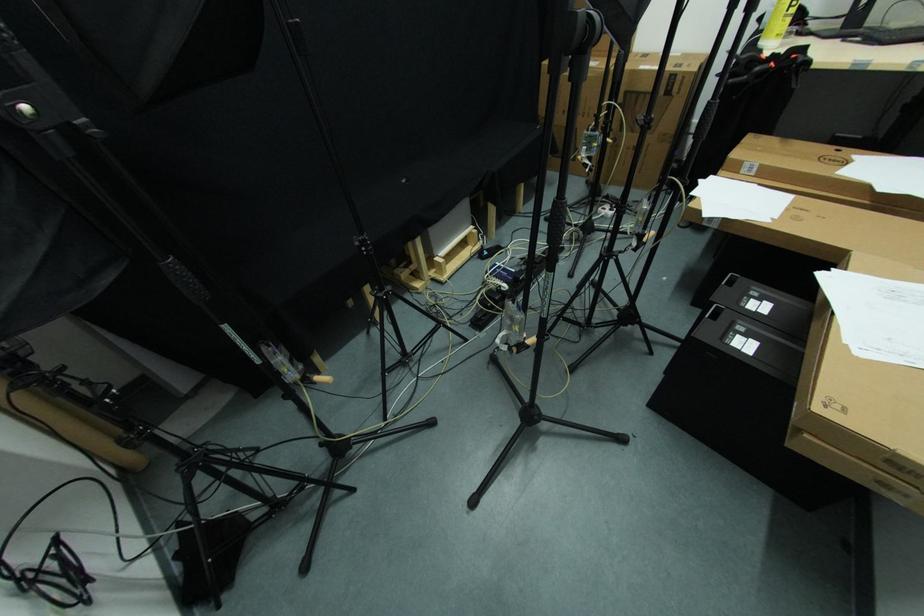
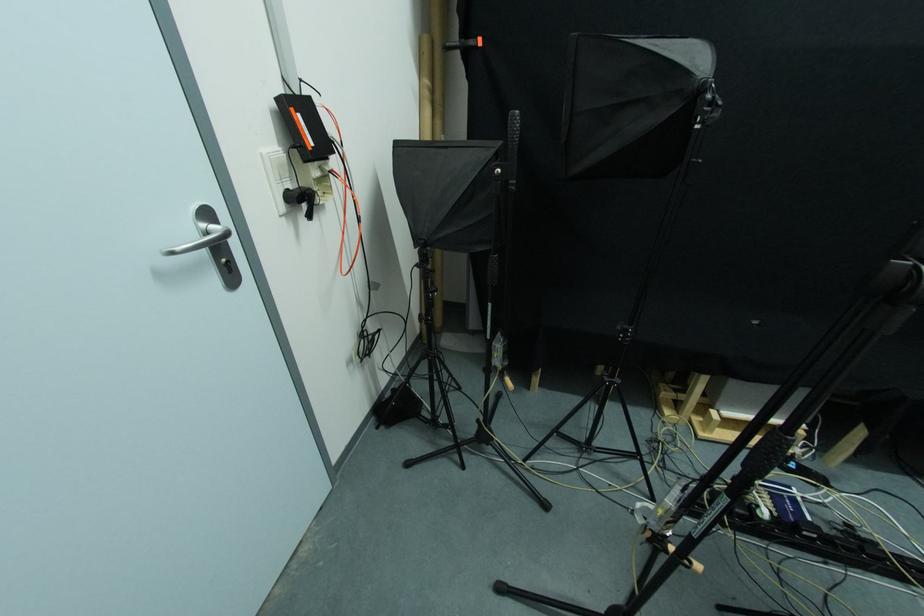
Locate, in the second image, the point that corresponds to the point at 88,130 in the first image.

(515, 187)